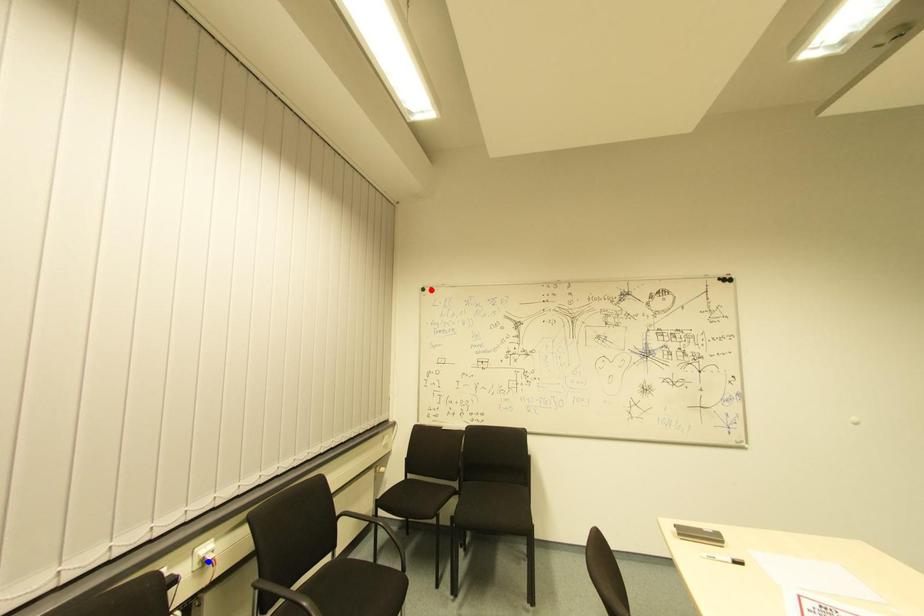
Question: In the image, two points are highlighted. Which point is nearer to the camera? Reply with the corresponding letter.

Choices:
 (A) blue point
 (B) red point

Answer: (A)